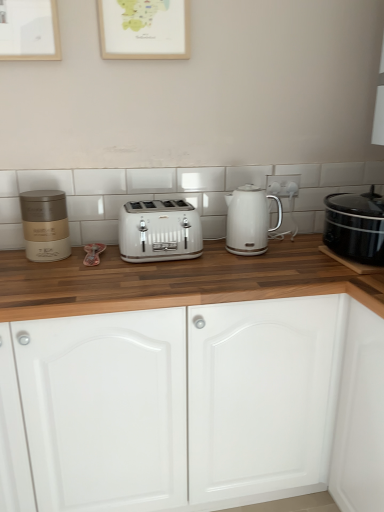
Question: From a real-world perspective, is matte gold container at left above or below wooden picture frame at upper center?

Choices:
 (A) below
 (B) above

Answer: (A)

Question: In the image, is matte gold container at left positioned in front of or behind wooden picture frame at upper center?

Choices:
 (A) behind
 (B) front

Answer: (A)

Question: Considering the real-world distances, which object is closest to the white glossy electric kettle at center?

Choices:
 (A) black glossy slow cooker at right
 (B) white glossy cabinet doors at center
 (C) matte gold container at left
 (D) wooden picture frame at upper center
 (E) white metallic toaster at center

Answer: (E)

Question: Which is farther from the wooden picture frame at upper center?

Choices:
 (A) white glossy electric kettle at center
 (B) white glossy electric outlet at upper center
 (C) black glossy slow cooker at right
 (D) white glossy cabinet doors at center
 (E) white metallic toaster at center

Answer: (C)